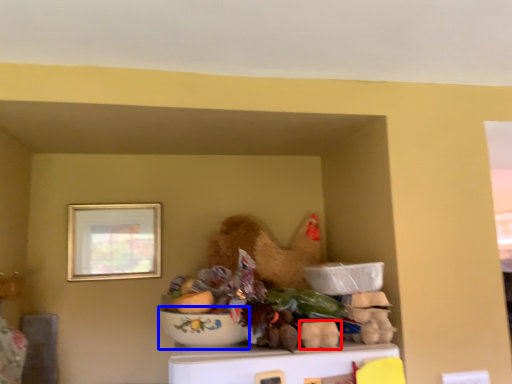
Question: Which object is closer to the camera taking this photo, food (highlighted by a red box) or bowl (highlighted by a blue box)?

Choices:
 (A) food
 (B) bowl

Answer: (B)